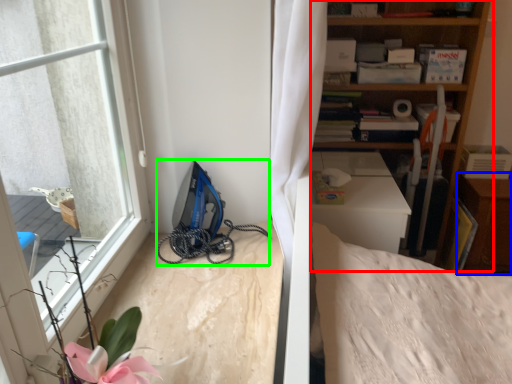
Question: Based on their relative distances, which object is nearer to shelf (highlighted by a red box)? Choose from dresser (highlighted by a blue box) and equipment (highlighted by a green box).

Choices:
 (A) dresser
 (B) equipment

Answer: (A)